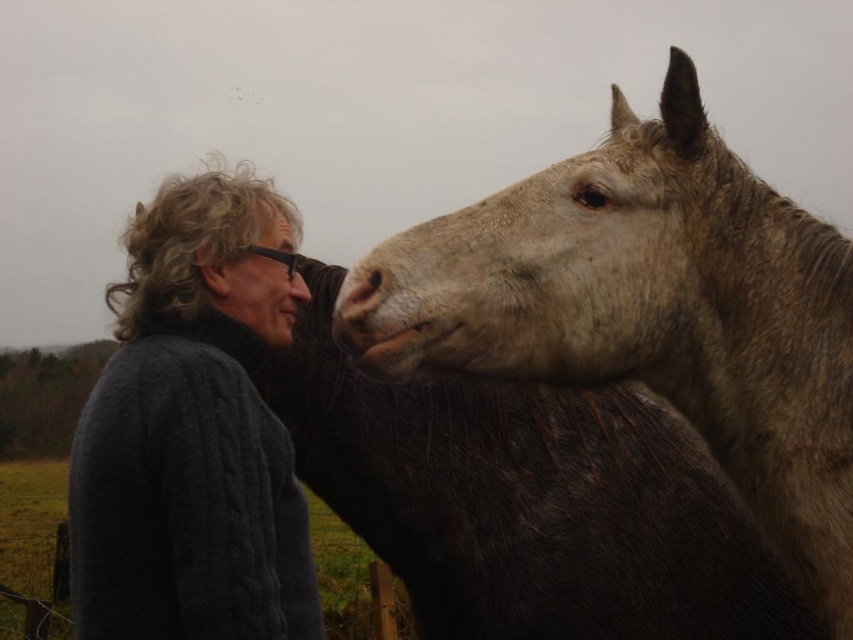
Question: Does grayish-brown fur at upper right have a smaller size compared to dark gray cable-knit sweater at left?

Choices:
 (A) yes
 (B) no

Answer: (B)

Question: Considering the relative positions of grayish-brown fur at upper right and dark gray cable-knit sweater at left in the image provided, where is grayish-brown fur at upper right located with respect to dark gray cable-knit sweater at left?

Choices:
 (A) left
 (B) right

Answer: (B)

Question: Among these objects, which one is nearest to the camera?

Choices:
 (A) dark gray cable-knit sweater at left
 (B) matte brown nose at center

Answer: (A)

Question: Which point is closer to the camera?

Choices:
 (A) (289, 548)
 (B) (289, 275)
 (C) (537, 310)

Answer: (C)

Question: Which of these objects is positioned closest to the grayish-brown fur at upper right?

Choices:
 (A) dark gray cable-knit sweater at left
 (B) matte brown nose at center

Answer: (A)

Question: Is dark gray cable-knit sweater at left closer to the viewer compared to matte brown nose at center?

Choices:
 (A) yes
 (B) no

Answer: (A)